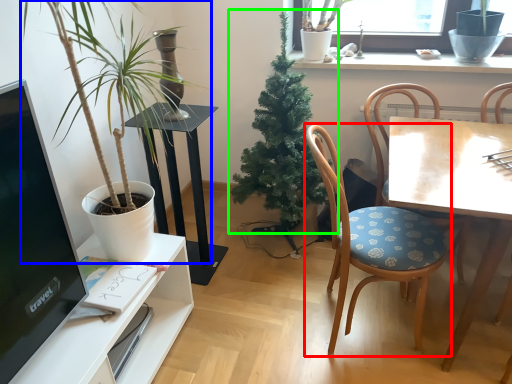
Question: Estimate the real-world distances between objects in this image. Which object is farther from chair (highlighted by a red box), houseplant (highlighted by a blue box) or houseplant (highlighted by a green box)?

Choices:
 (A) houseplant
 (B) houseplant

Answer: (A)